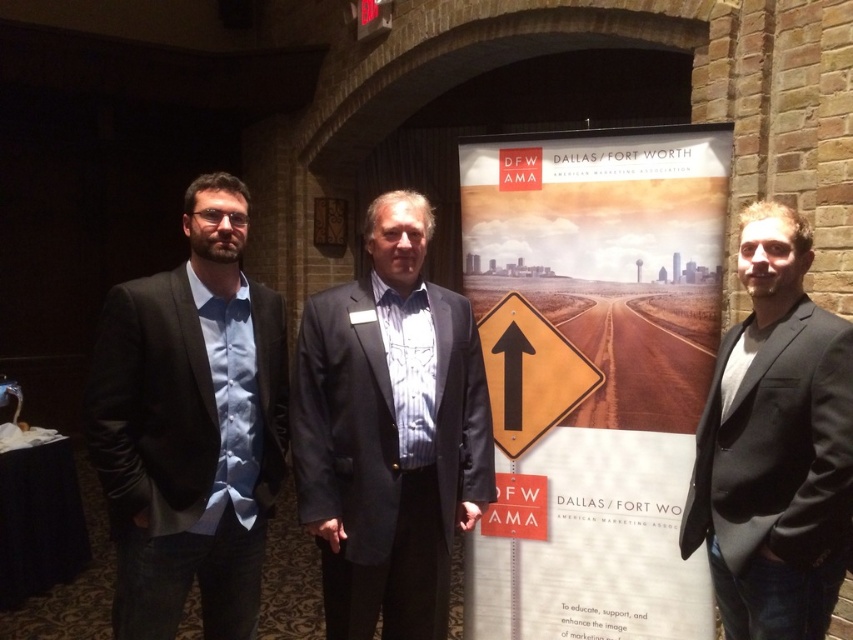
Which is more to the right, orange paper sign at center or matte black suit at left?

orange paper sign at center

Find the location of a particular element. The image size is (853, 640). orange paper sign at center is located at coordinates click(x=595, y=371).

Is point (521, 365) positioned in front of point (207, 520)?

No, (521, 365) is behind (207, 520).

Where is `orange paper sign at center`? The image size is (853, 640). orange paper sign at center is located at coordinates (595, 371).

Which of these two, orange paper sign at center or dark gray suit at center, stands shorter?

Standing shorter between the two is dark gray suit at center.

Does orange paper sign at center appear on the left side of dark gray suit at center?

Incorrect, orange paper sign at center is not on the left side of dark gray suit at center.

Where is `orange paper sign at center`? The height and width of the screenshot is (640, 853). orange paper sign at center is located at coordinates (595, 371).

The height and width of the screenshot is (640, 853). I want to click on orange paper sign at center, so click(x=595, y=371).

Does point (323, 305) come closer to viewer compared to point (750, 212)?

That is False.

Can you confirm if dark gray suit at center is taller than dark gray suit at right?

Correct, dark gray suit at center is much taller as dark gray suit at right.

Which is in front, point (433, 451) or point (782, 552)?

Positioned in front is point (782, 552).

You are a GUI agent. You are given a task and a screenshot of the screen. Output one action in this format:
    pyautogui.click(x=<x>, y=<y>)
    Task: Click on the dark gray suit at center
    This screenshot has height=640, width=853.
    Given the screenshot: What is the action you would take?
    pyautogui.click(x=389, y=433)